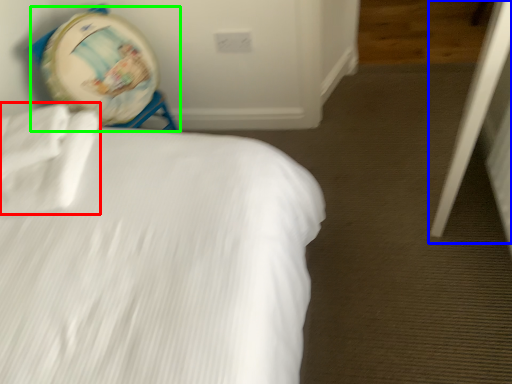
Question: Which object is positioned farthest from sheet (highlighted by a red box)? Select from screen door (highlighted by a blue box) and swivel chair (highlighted by a green box).

Choices:
 (A) screen door
 (B) swivel chair

Answer: (A)